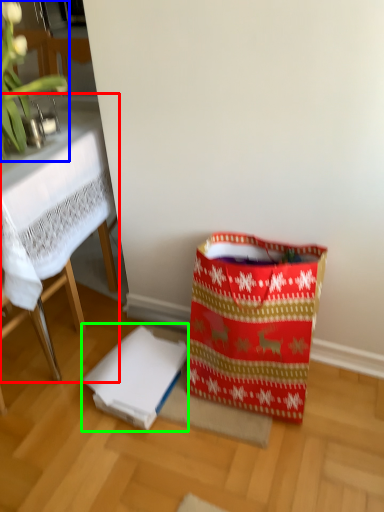
Question: Based on their relative distances, which object is nearer to table (highlighted by a red box)? Choose from orchid (highlighted by a blue box) and cardboard box (highlighted by a green box).

Choices:
 (A) orchid
 (B) cardboard box

Answer: (A)